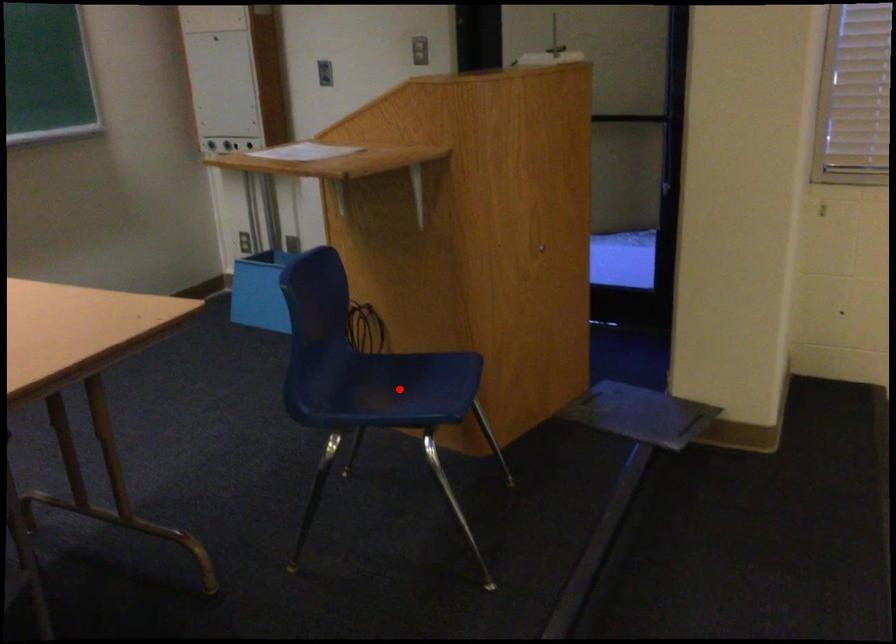
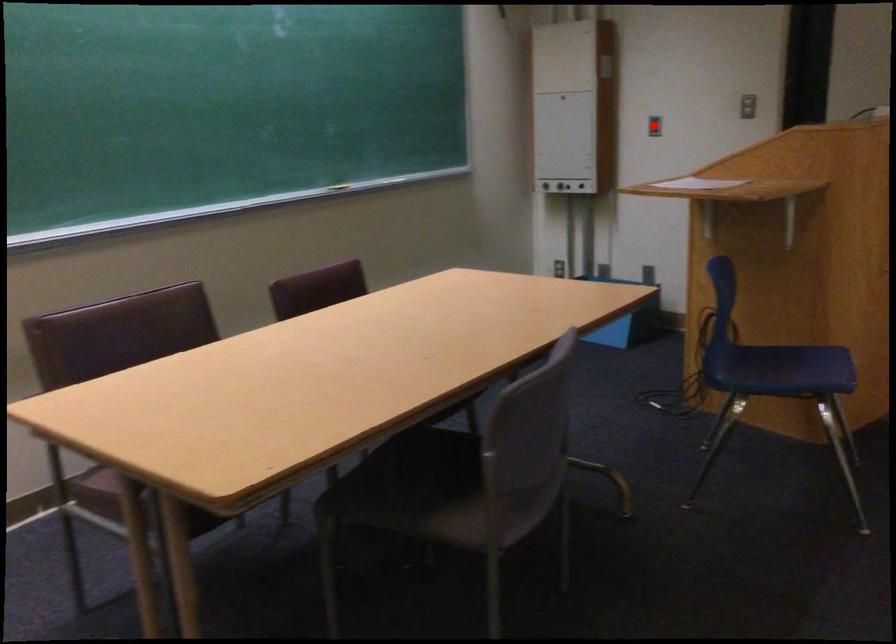
I am providing you with two images of the same scene from different viewpoints. A red point is marked on the first image and another point is marked on the second image. Is the marked point in image1 the same physical position as the marked point in image2?

No